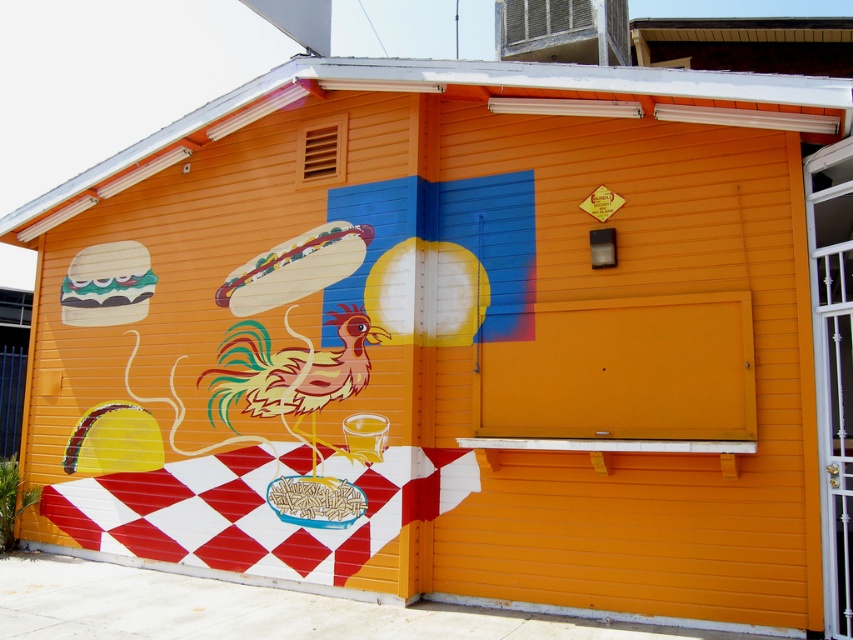
Question: Does orange matte garage door at center appear over wooden hot dog at center?

Choices:
 (A) yes
 (B) no

Answer: (B)

Question: Where is orange matte garage door at center located in relation to wooden hot dog at center in the image?

Choices:
 (A) right
 (B) left

Answer: (A)

Question: Does orange matte garage door at center have a lesser width compared to wooden hot dog at center?

Choices:
 (A) yes
 (B) no

Answer: (B)

Question: Which point is farther to the camera?

Choices:
 (A) (338, 232)
 (B) (683, 384)

Answer: (A)